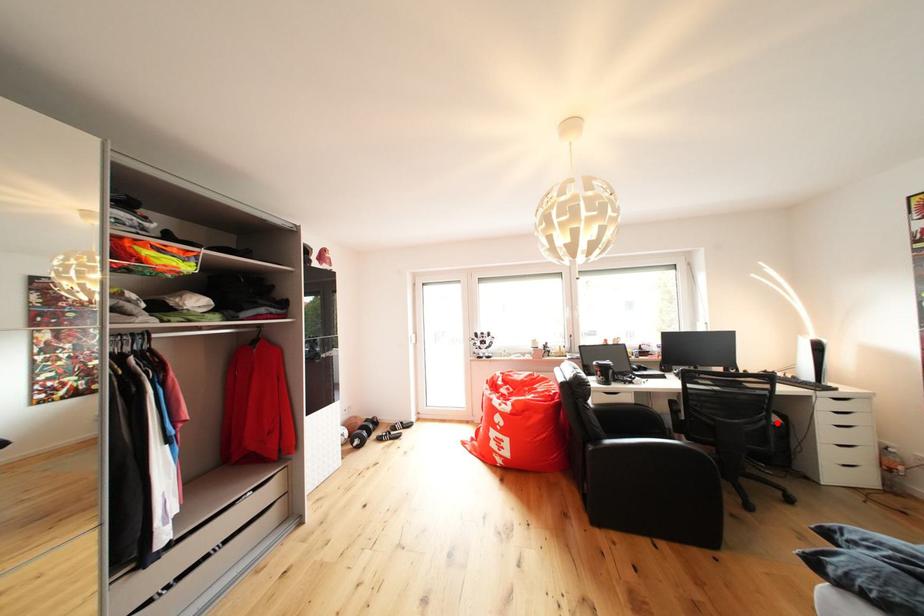
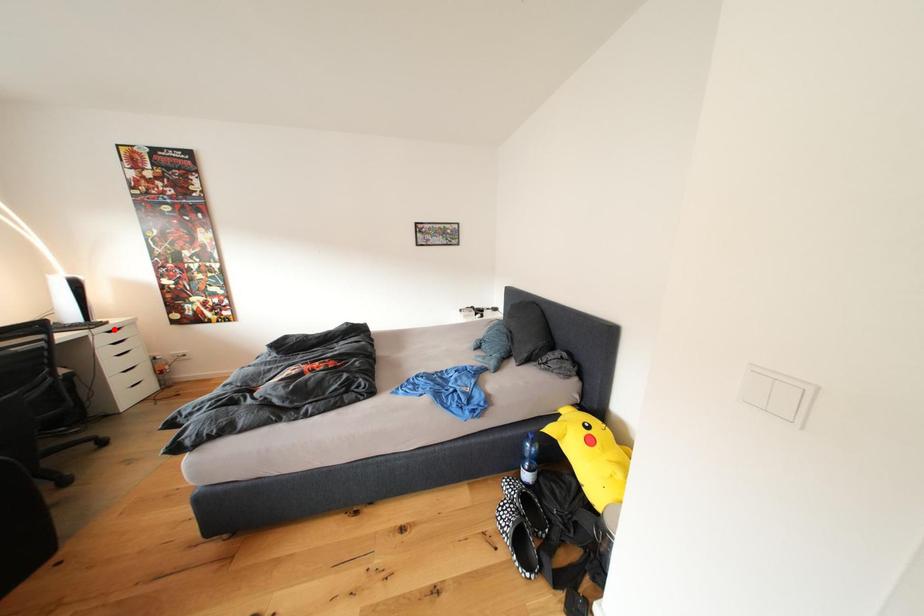
I am providing you with two images of the same scene from different viewpoints. A red point is marked on the first image and another point is marked on the second image. Is the red point in image1 aligned with the point shown in image2?

No